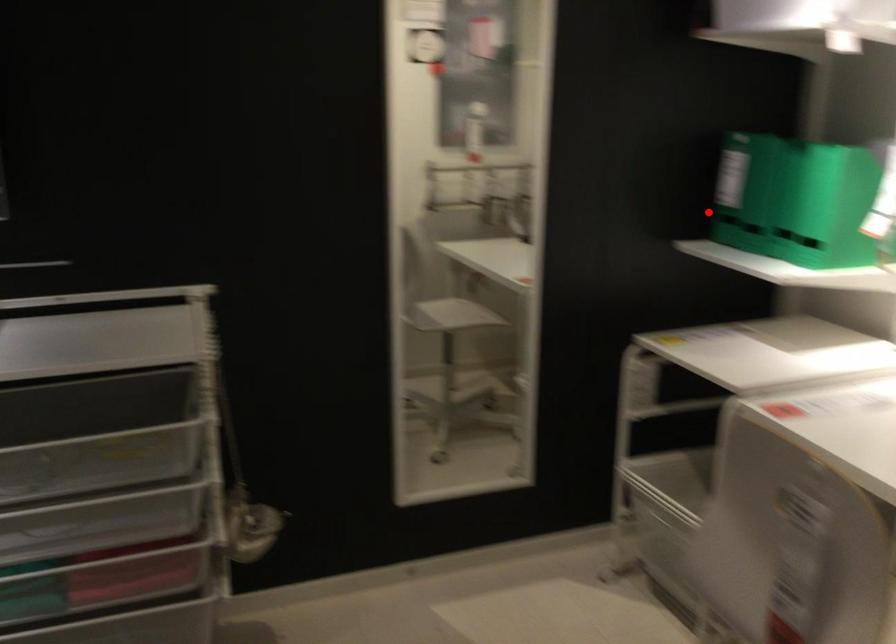
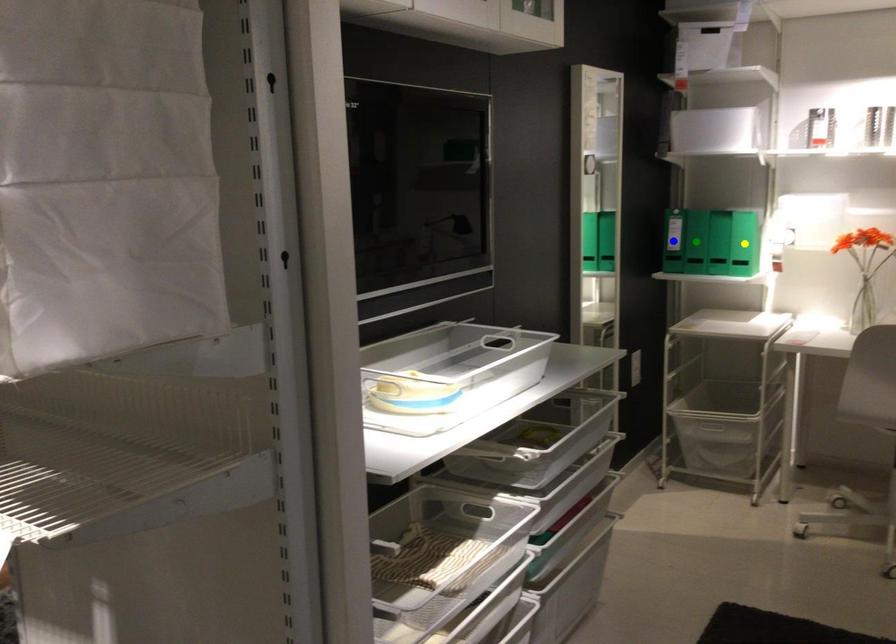
Question: I am providing you with two images of the same scene from different viewpoints. A red point is marked on the first image. You are given multiple points on the second image. Which spot in image 2 lines up with the point in image 1?

Choices:
 (A) blue point
 (B) green point
 (C) yellow point

Answer: (B)